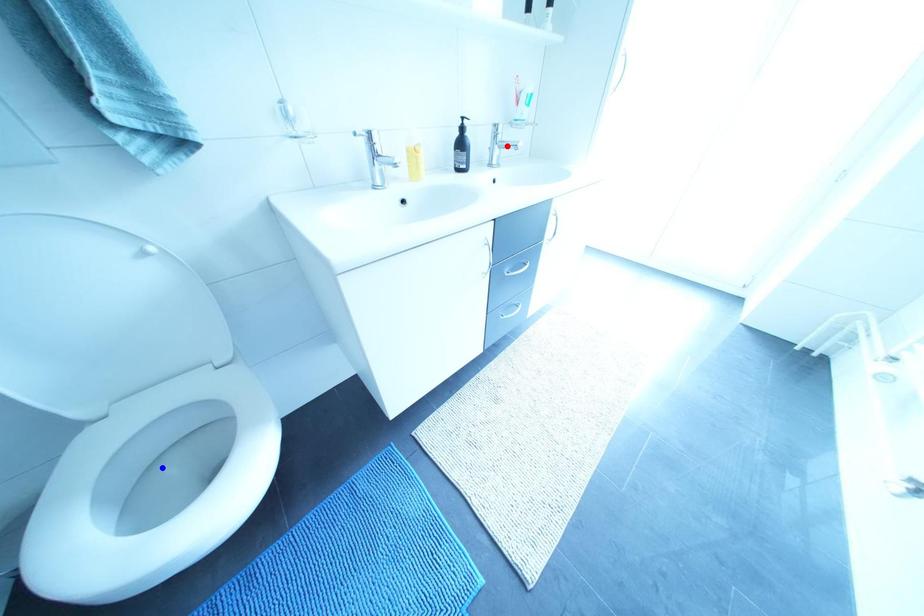
Question: In the image, two points are highlighted. Which point is nearer to the camera? Reply with the corresponding letter.

Choices:
 (A) blue point
 (B) red point

Answer: (A)